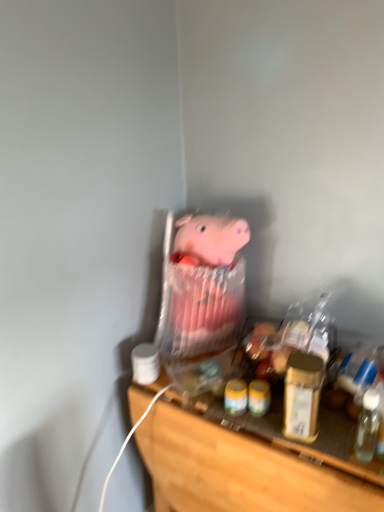
Question: Does pink fabric pig at center come behind wooden shelf at lower center?

Choices:
 (A) no
 (B) yes

Answer: (B)

Question: Is pink fabric pig at center oriented towards wooden shelf at lower center?

Choices:
 (A) yes
 (B) no

Answer: (B)

Question: Is pink fabric pig at center at the right side of wooden shelf at lower center?

Choices:
 (A) no
 (B) yes

Answer: (A)

Question: From a real-world perspective, is pink fabric pig at center located beneath wooden shelf at lower center?

Choices:
 (A) no
 (B) yes

Answer: (A)

Question: Is pink fabric pig at center closer to the viewer compared to wooden shelf at lower center?

Choices:
 (A) no
 (B) yes

Answer: (A)

Question: Would you say pink fabric pig at center is outside wooden shelf at lower center?

Choices:
 (A) yes
 (B) no

Answer: (A)

Question: Considering the relative sizes of transparent plastic bottle at right and pink fabric pig at center in the image provided, is transparent plastic bottle at right smaller than pink fabric pig at center?

Choices:
 (A) no
 (B) yes

Answer: (B)

Question: Is there a large distance between transparent plastic bottle at right and pink fabric pig at center?

Choices:
 (A) yes
 (B) no

Answer: (B)

Question: From a real-world perspective, does transparent plastic bottle at right sit lower than pink fabric pig at center?

Choices:
 (A) yes
 (B) no

Answer: (A)

Question: Can you confirm if transparent plastic bottle at right is positioned to the right of pink fabric pig at center?

Choices:
 (A) no
 (B) yes

Answer: (B)

Question: Does transparent plastic bottle at right turn towards pink fabric pig at center?

Choices:
 (A) yes
 (B) no

Answer: (B)

Question: From the image's perspective, is transparent plastic bottle at right above pink fabric pig at center?

Choices:
 (A) yes
 (B) no

Answer: (B)

Question: From a real-world perspective, is wooden shelf at lower center beneath gold metallic jar at right?

Choices:
 (A) yes
 (B) no

Answer: (A)